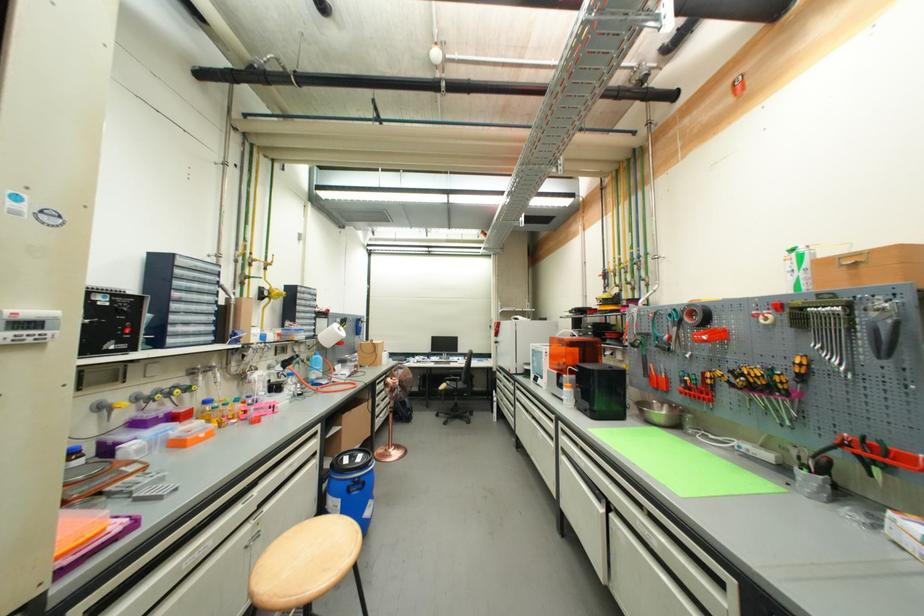
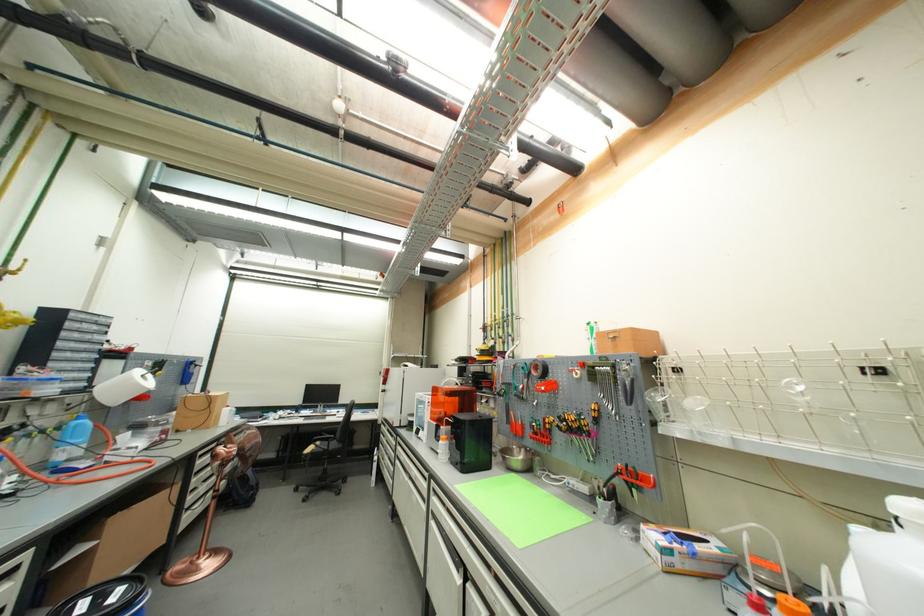
The point at (664,406) is marked in the first image. Where is the corresponding point in the second image?

(524, 451)